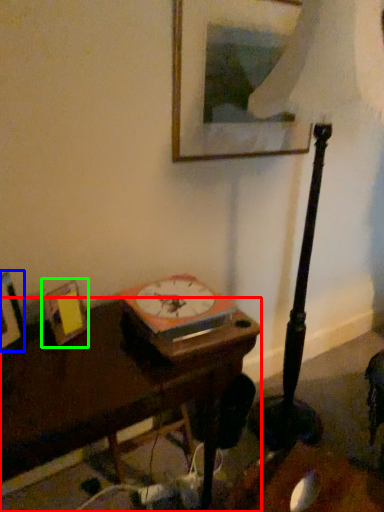
Question: Considering the real-world distances, which object is closest to table (highlighted by a red box)? picture frame (highlighted by a blue box) or picture frame (highlighted by a green box).

Choices:
 (A) picture frame
 (B) picture frame

Answer: (B)